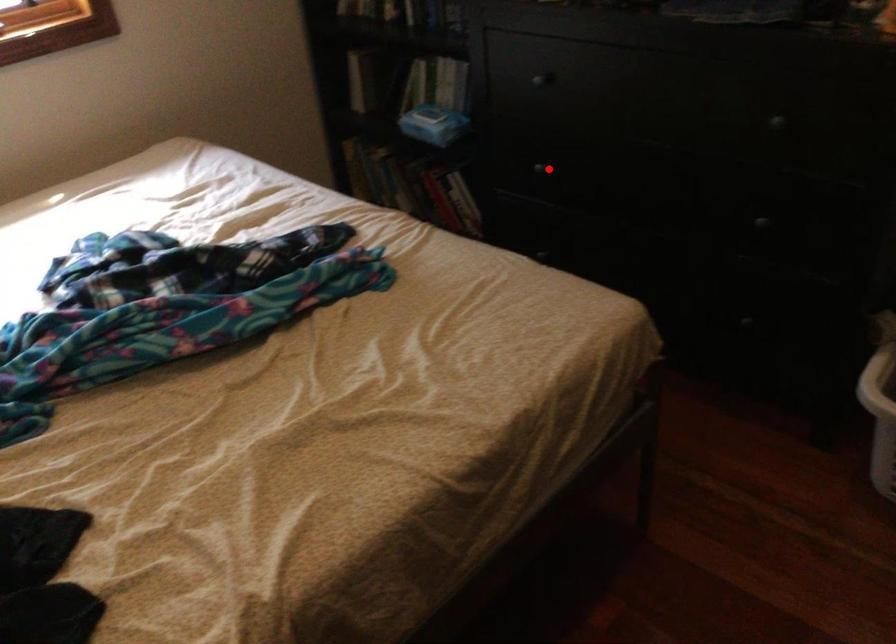
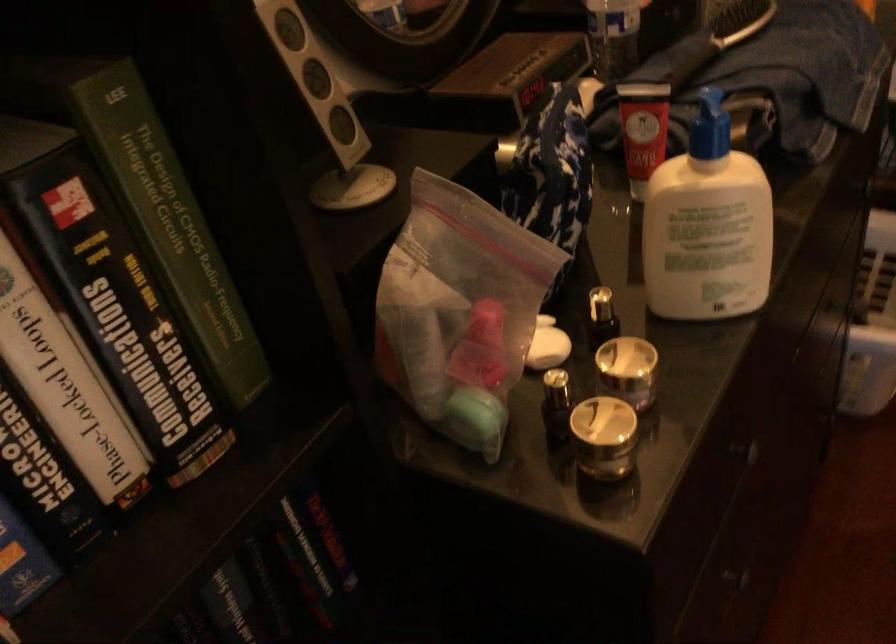
Question: I am providing you with two images of the same scene from different viewpoints. In image1, a red point is highlighted. Considering the same 3D point in image2, which of the following is correct?

Choices:
 (A) It is closer
 (B) It is farther

Answer: (A)